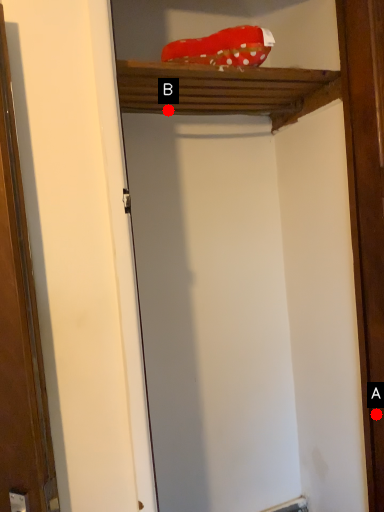
Question: Two points are circled on the image, labeled by A and B beside each circle. Which of the following is the farthest from the observer?

Choices:
 (A) A is further
 (B) B is further

Answer: (B)